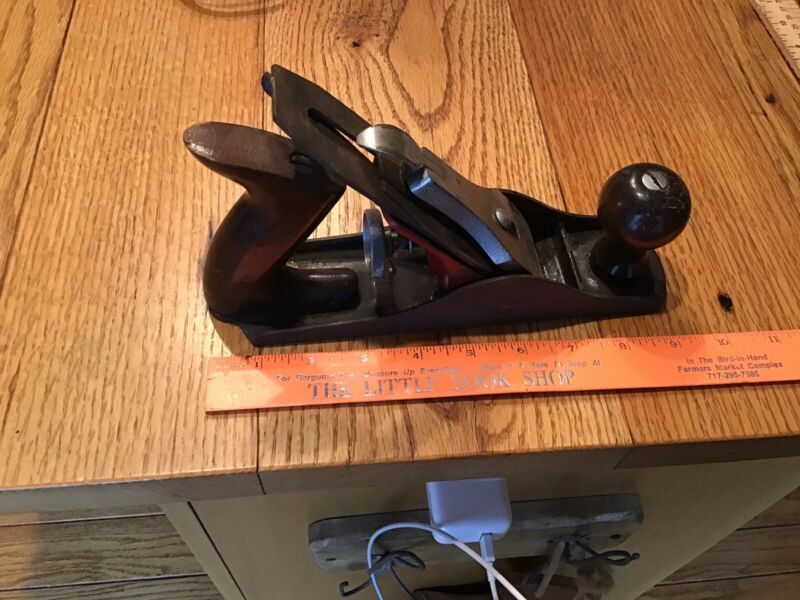
The image size is (800, 600). I want to click on floor, so click(x=104, y=535).